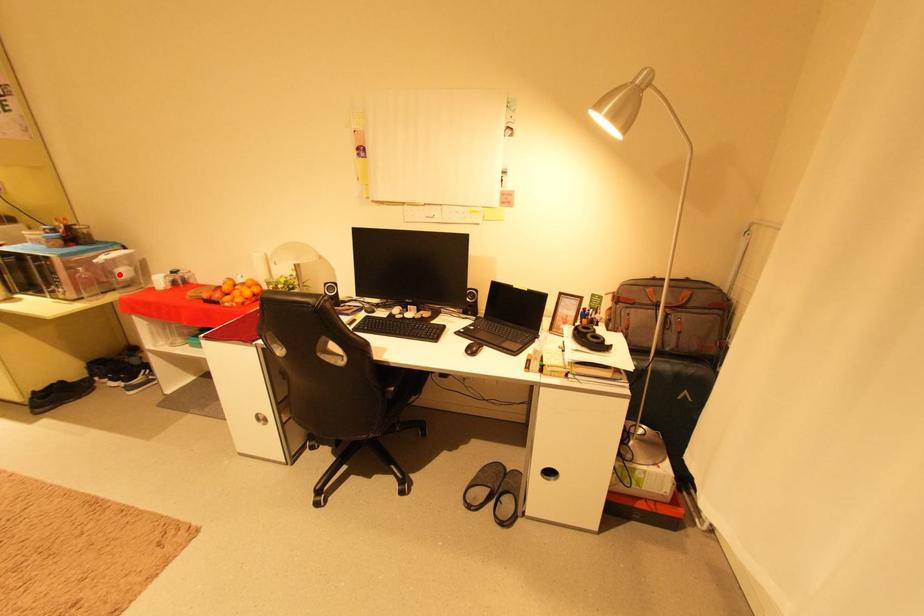
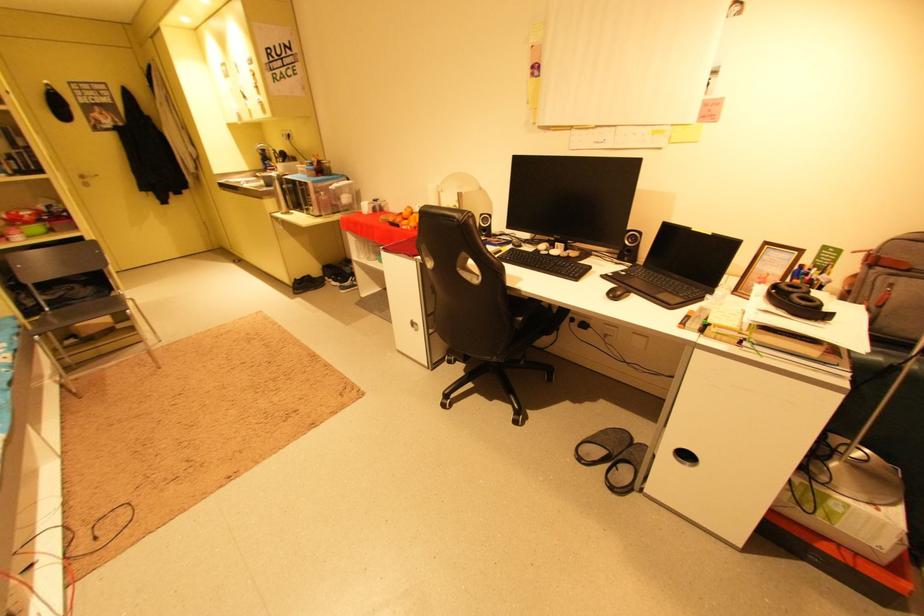
Locate, in the second image, the point that corresponds to the highlighted location in the first image.

(346, 200)